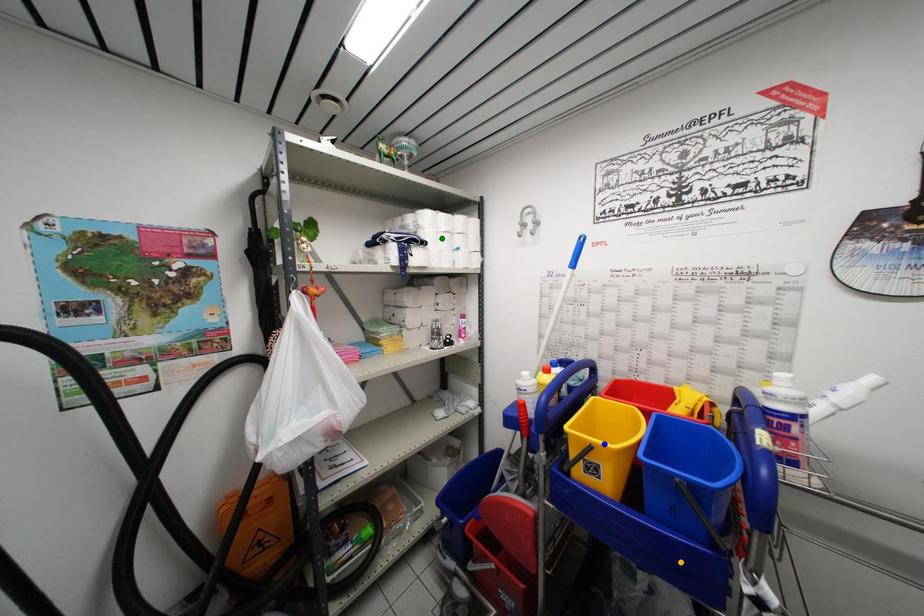
Order these from nearest to farthest:
green point
blue point
orange point

green point → blue point → orange point